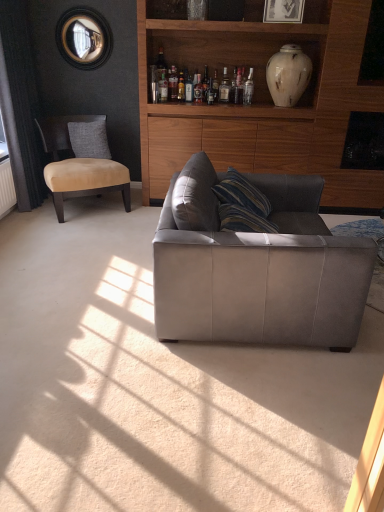
Question: From the image's perspective, is clear glass bottle at upper center, placed as the 1th bottle when sorted from left to right, over suede beige chair at left?

Choices:
 (A) yes
 (B) no

Answer: (A)

Question: Does clear glass bottle at upper center, the 5th bottle in the right-to-left sequence, have a smaller size compared to suede beige chair at left?

Choices:
 (A) yes
 (B) no

Answer: (A)

Question: Can you confirm if clear glass bottle at upper center, placed as the 1th bottle when sorted from left to right, is positioned to the left of suede beige chair at left?

Choices:
 (A) yes
 (B) no

Answer: (B)

Question: Is clear glass bottle at upper center, placed as the 1th bottle when sorted from left to right, looking in the opposite direction of suede beige chair at left?

Choices:
 (A) no
 (B) yes

Answer: (A)

Question: From the image's perspective, is clear glass bottle at upper center, placed as the 1th bottle when sorted from left to right, below suede beige chair at left?

Choices:
 (A) yes
 (B) no

Answer: (B)

Question: Considering their positions, is wooden cabinet at upper center located in front of or behind translucent glass bottle at upper center, marked as the fourth bottle in a right-to-left arrangement?

Choices:
 (A) behind
 (B) front

Answer: (B)

Question: From their relative heights in the image, would you say wooden cabinet at upper center is taller or shorter than translucent glass bottle at upper center, marked as the fourth bottle in a right-to-left arrangement?

Choices:
 (A) tall
 (B) short

Answer: (A)

Question: Does point (311, 54) appear closer or farther from the camera than point (162, 93)?

Choices:
 (A) farther
 (B) closer

Answer: (B)

Question: Is wooden cabinet at upper center bigger or smaller than translucent glass bottle at upper center, marked as the fourth bottle in a right-to-left arrangement?

Choices:
 (A) big
 (B) small

Answer: (A)

Question: Do you think suede beige chair at left is within white marble vase at upper right, or outside of it?

Choices:
 (A) outside
 (B) inside

Answer: (A)

Question: Is point (105, 134) closer or farther from the camera than point (306, 81)?

Choices:
 (A) farther
 (B) closer

Answer: (A)

Question: In terms of height, does suede beige chair at left look taller or shorter compared to white marble vase at upper right?

Choices:
 (A) short
 (B) tall

Answer: (B)

Question: From a real-world perspective, relative to white marble vase at upper right, is suede beige chair at left vertically above or below?

Choices:
 (A) below
 (B) above

Answer: (A)

Question: Relative to translucent glass bottle at upper center, marked as the fourth bottle in a right-to-left arrangement, is clear glass bottle at upper center, placed as the first bottle when sorted from right to left, in front or behind?

Choices:
 (A) front
 (B) behind

Answer: (B)

Question: Looking at their shapes, would you say clear glass bottle at upper center, placed as the first bottle when sorted from right to left, is wider or thinner than translucent glass bottle at upper center, which appears as the 2th bottle when viewed from the left?

Choices:
 (A) wide
 (B) thin

Answer: (A)